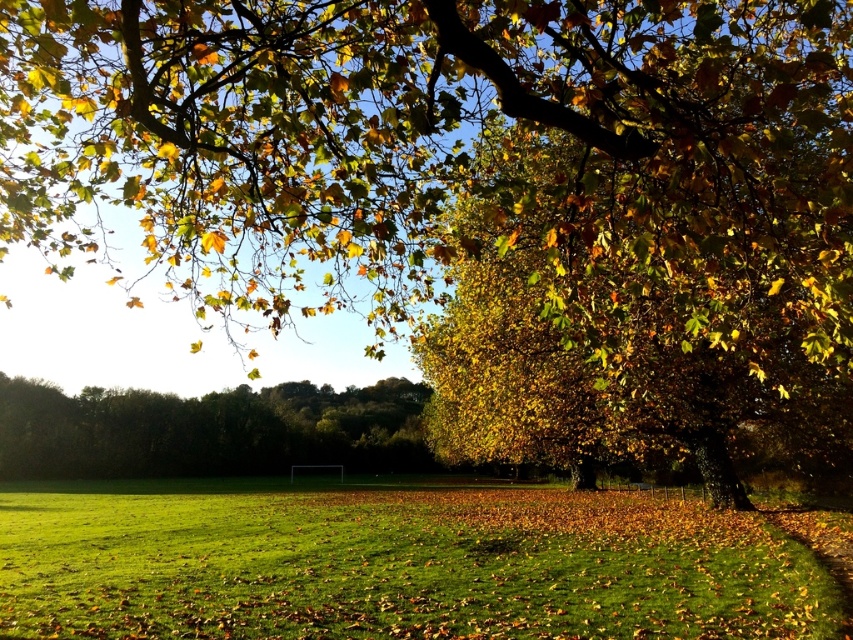
You are standing in the autumn park scene. You need to place a 2 meter wide picnic blanket. Which area between the green grassy field at center and the green leafy tree at center can accommodate it?

The green grassy field at center has a larger width than the green leafy tree at center, so the picnic blanket can be placed on the green grassy field at center.

You are a gardener who wants to plant a new flower bed between the green grassy field at center and the green leafy tree at center. Considering their heights, which one should you place the flowers closer to?

The green grassy field at center is shorter than the green leafy tree at center, so you should place the flowers closer to the green grassy field at center to ensure they receive adequate sunlight.